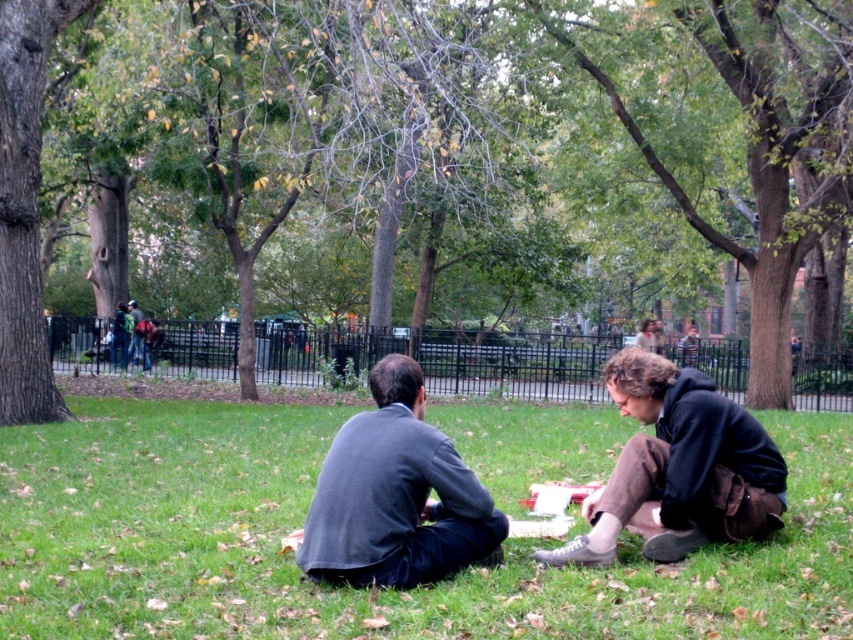
Question: Which point appears closest to the camera in this image?

Choices:
 (A) (462, 544)
 (B) (648, 492)

Answer: (A)

Question: Which object is closer to the camera taking this photo?

Choices:
 (A) brown textured tree at center
 (B) dark gray sweater at center

Answer: (B)

Question: Does brown textured tree at center have a larger size compared to dark brown hoodie at lower right?

Choices:
 (A) yes
 (B) no

Answer: (A)

Question: Which object is farther from the camera taking this photo?

Choices:
 (A) green grass at center
 (B) dark brown hoodie at lower right
 (C) dark gray sweater at center

Answer: (B)

Question: Considering the relative positions of brown textured tree at center and dark gray sweater at center in the image provided, where is brown textured tree at center located with respect to dark gray sweater at center?

Choices:
 (A) left
 (B) right

Answer: (B)

Question: Can you confirm if green grass at center is positioned to the right of dark brown hoodie at lower right?

Choices:
 (A) yes
 (B) no

Answer: (B)